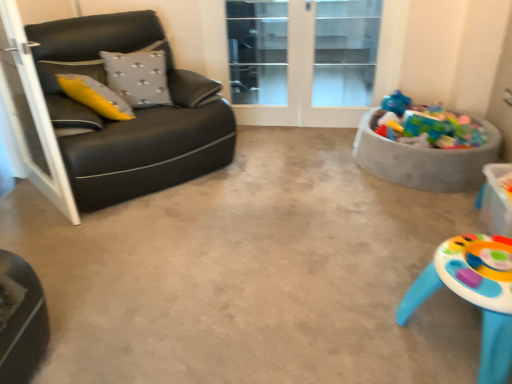
You are a GUI agent. You are given a task and a screenshot of the screen. Output one action in this format:
    pyautogui.click(x=<x>, y=<y>)
    Task: Click on the free spot below matte plastic table at lower right (from a real-world perspective)
    This screenshot has height=384, width=512.
    Given the screenshot: What is the action you would take?
    pyautogui.click(x=450, y=333)